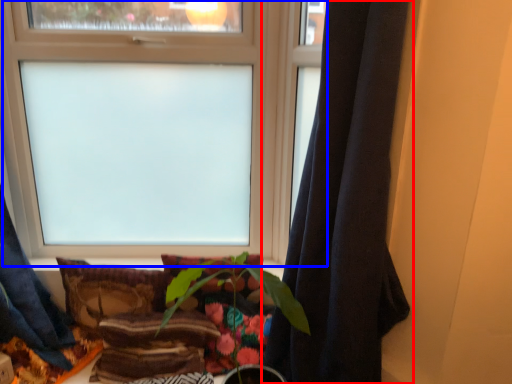
Question: Which point is closer to the camera, curtain (highlighted by a red box) or window (highlighted by a blue box)?

Choices:
 (A) curtain
 (B) window

Answer: (A)